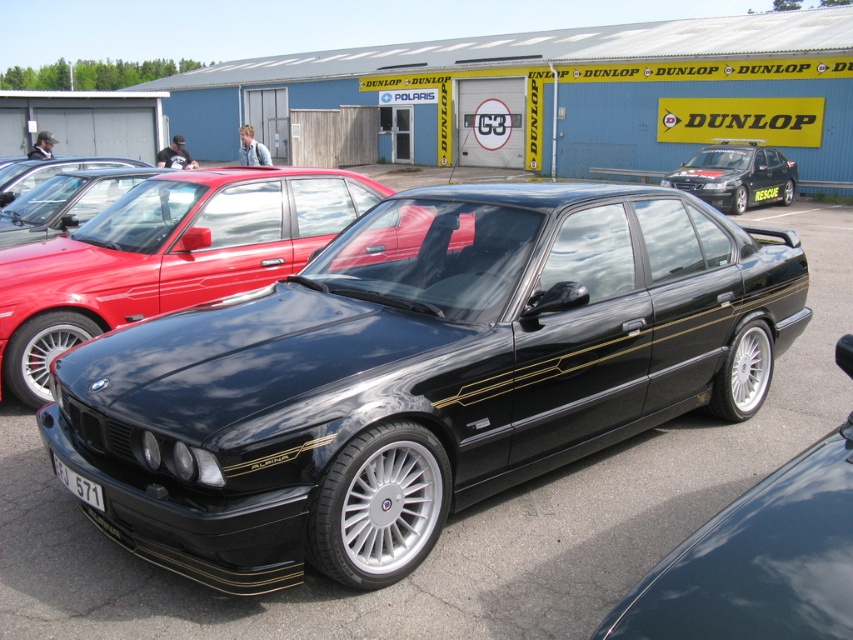
You are a photographer standing in front of the BMW Alpina B10. You want to take a photo of the car but ensure the white plastic license plate at lower left is not visible in the shot. Based on its location, which direction should you move your camera to avoid capturing it?

To avoid capturing the white plastic license plate at lower left, move your camera to the right, as the license plate is located at the lower left position.

You are standing in front of the BMW Alpina B10 at the car exhibition. There are two points marked on the car. One is at coordinates point (141, 177) and the other is at point (22, 180). Which of these two points is closer to you?

Point (141, 177) is closer to the viewer than point (22, 180).

Based on the photo, you are a parking attendant and need to ensure there is enough space between the matte black car at center and the matte black car at upper left to allow a 17.5 inch wide delivery cart to pass through. Can the delivery cart fit through the space between them?

The space between the matte black car at center and the matte black car at upper left is 17.60 inches. Since the delivery cart is 17.5 inches wide, it can just barely fit through the space between them.